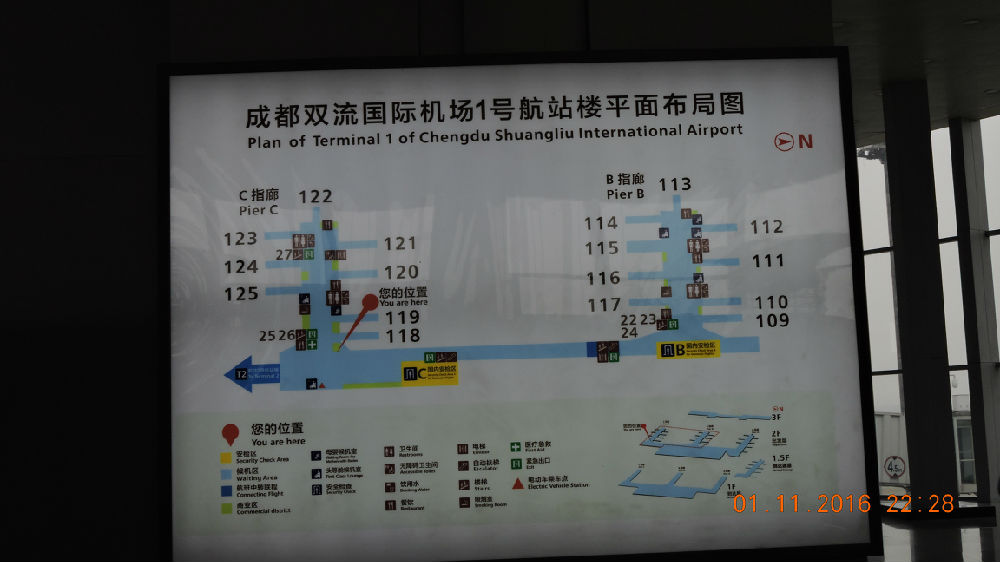
I want to click on tv frame top, so click(x=472, y=61).